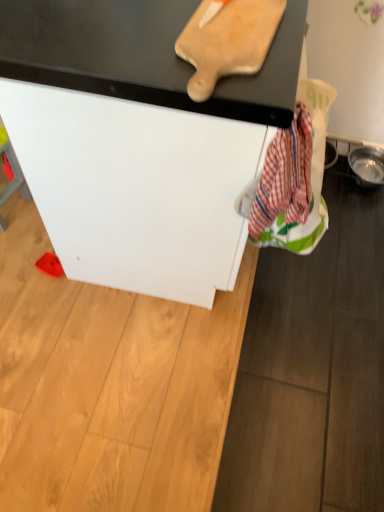
The width and height of the screenshot is (384, 512). What do you see at coordinates (138, 139) in the screenshot?
I see `white matte cabinet at center` at bounding box center [138, 139].

Locate an element on the screen. wooden cutting board at upper center is located at coordinates (227, 40).

What do you see at coordinates (227, 40) in the screenshot? I see `wooden cutting board at upper center` at bounding box center [227, 40].

Find the location of a particular element. white matte cabinet at center is located at coordinates (138, 139).

Is there a large distance between red plaid fabric at lower right and white matte cabinet at center?

They are positioned close to each other.

Is white matte cabinet at center completely or partially inside red plaid fabric at lower right?

Actually, white matte cabinet at center is outside red plaid fabric at lower right.

From the image's perspective, which object appears higher, red plaid fabric at lower right or white matte cabinet at center?

white matte cabinet at center is shown above in the image.

From the image's perspective, who appears lower, red plaid fabric at lower right or wooden cutting board at upper center?

red plaid fabric at lower right, from the image's perspective.

Considering the sizes of objects red plaid fabric at lower right and wooden cutting board at upper center in the image provided, who is wider, red plaid fabric at lower right or wooden cutting board at upper center?

With larger width is wooden cutting board at upper center.

Based on the photo, is red plaid fabric at lower right bigger than wooden cutting board at upper center?

Yes, red plaid fabric at lower right is bigger than wooden cutting board at upper center.

Image resolution: width=384 pixels, height=512 pixels. I want to click on cutting board on the left of red plaid fabric at lower right, so click(227, 40).

Does wooden cutting board at upper center appear on the left side of white matte cabinet at center?

In fact, wooden cutting board at upper center is to the right of white matte cabinet at center.

Could white matte cabinet at center be considered to be inside wooden cutting board at upper center?

No, white matte cabinet at center is located outside of wooden cutting board at upper center.

Can you see wooden cutting board at upper center touching white matte cabinet at center?

No, wooden cutting board at upper center is not in contact with white matte cabinet at center.

Is wooden cutting board at upper center looking in the opposite direction of white matte cabinet at center?

Yes, wooden cutting board at upper center is facing away from white matte cabinet at center.

Can you confirm if wooden cutting board at upper center is shorter than red plaid fabric at lower right?

Correct, wooden cutting board at upper center is not as tall as red plaid fabric at lower right.

From a real-world perspective, relative to red plaid fabric at lower right, is wooden cutting board at upper center vertically above or below?

In terms of real-world spatial position, wooden cutting board at upper center is above red plaid fabric at lower right.

Consider the image. Considering the relative sizes of wooden cutting board at upper center and red plaid fabric at lower right in the image provided, is wooden cutting board at upper center bigger than red plaid fabric at lower right?

Incorrect, wooden cutting board at upper center is not larger than red plaid fabric at lower right.

Where is `laundry below the wooden cutting board at upper center (from a real-world perspective)`? The height and width of the screenshot is (512, 384). laundry below the wooden cutting board at upper center (from a real-world perspective) is located at coordinates (311, 170).

Does white matte cabinet at center have a greater height compared to red plaid fabric at lower right?

Correct, white matte cabinet at center is much taller as red plaid fabric at lower right.

Are white matte cabinet at center and red plaid fabric at lower right beside each other?

No, white matte cabinet at center is not next to red plaid fabric at lower right.

Considering the relative positions of white matte cabinet at center and red plaid fabric at lower right in the image provided, is white matte cabinet at center to the left of red plaid fabric at lower right from the viewer's perspective?

Correct, you'll find white matte cabinet at center to the left of red plaid fabric at lower right.

Consider the image. Which of these two, white matte cabinet at center or red plaid fabric at lower right, is smaller?

red plaid fabric at lower right.

Is white matte cabinet at center spatially inside wooden cutting board at upper center, or outside of it?

white matte cabinet at center cannot be found inside wooden cutting board at upper center.

From the image's perspective, which one is positioned lower, white matte cabinet at center or wooden cutting board at upper center?

From the image's view, wooden cutting board at upper center is below.

Considering the relative sizes of white matte cabinet at center and wooden cutting board at upper center in the image provided, is white matte cabinet at center thinner than wooden cutting board at upper center?

No.

Does white matte cabinet at center turn towards wooden cutting board at upper center?

No, white matte cabinet at center does not turn towards wooden cutting board at upper center.

At what (x,y) coordinates should I click in order to perform the action: click on furniture in front of the red plaid fabric at lower right. Please return your answer as a coordinate pair (x, y). This screenshot has height=512, width=384. Looking at the image, I should click on (138, 139).

Find the location of `laundry behind the wooden cutting board at upper center`. laundry behind the wooden cutting board at upper center is located at coordinates (311, 170).

Based on their spatial positions, is red plaid fabric at lower right or wooden cutting board at upper center closer to white matte cabinet at center?

red plaid fabric at lower right.

Estimate the real-world distances between objects in this image. Which object is closer to white matte cabinet at center, wooden cutting board at upper center or red plaid fabric at lower right?

The object closer to white matte cabinet at center is red plaid fabric at lower right.

Considering their positions, is white matte cabinet at center positioned closer to red plaid fabric at lower right than wooden cutting board at upper center?

white matte cabinet at center lies closer to red plaid fabric at lower right than the other object.

From the image, which object appears to be nearer to wooden cutting board at upper center, white matte cabinet at center or red plaid fabric at lower right?

white matte cabinet at center is positioned closer to the anchor wooden cutting board at upper center.

Based on their spatial positions, is wooden cutting board at upper center or white matte cabinet at center further from red plaid fabric at lower right?

wooden cutting board at upper center lies further to red plaid fabric at lower right than the other object.

From the image, which object appears to be farther from wooden cutting board at upper center, red plaid fabric at lower right or white matte cabinet at center?

Based on the image, red plaid fabric at lower right appears to be further to wooden cutting board at upper center.

I want to click on cutting board that lies between white matte cabinet at center and red plaid fabric at lower right from top to bottom, so click(x=227, y=40).